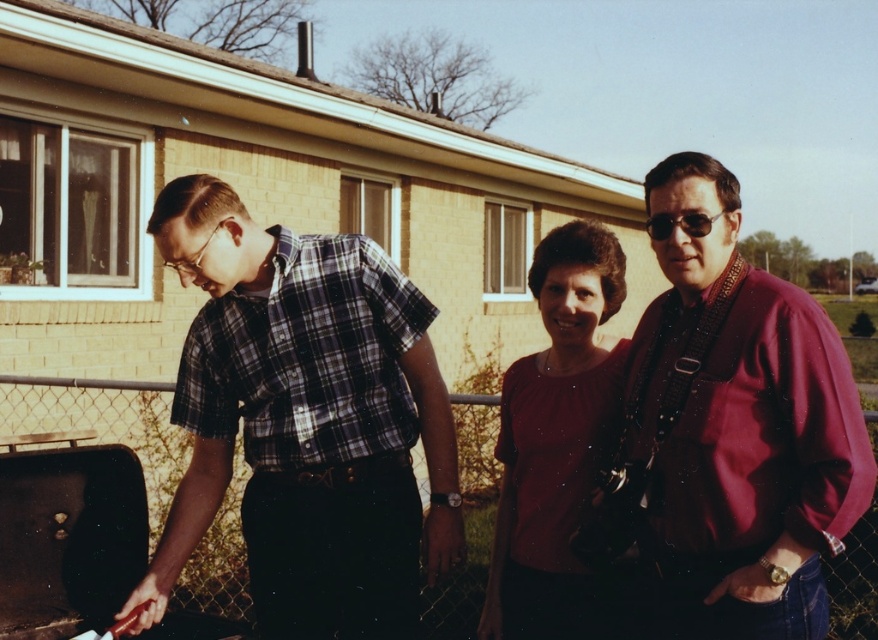
Question: Is plaid shirt at center thinner than metal chain-link fence at center?

Choices:
 (A) yes
 (B) no

Answer: (B)

Question: Estimate the real-world distances between objects in this image. Which object is closer to the plaid shirt at center?

Choices:
 (A) matte red blouse at center
 (B) metal chain-link fence at center
 (C) shiny black sunglasses at right
 (D) maroon fabric shirt at right

Answer: (A)

Question: Is maroon fabric shirt at right above shiny black sunglasses at right?

Choices:
 (A) yes
 (B) no

Answer: (B)

Question: Which of these objects is positioned closest to the shiny black sunglasses at right?

Choices:
 (A) metal chain-link fence at center
 (B) maroon fabric shirt at right
 (C) plaid shirt at center
 (D) matte red blouse at center

Answer: (B)

Question: Which point is closer to the camera taking this photo?

Choices:
 (A) (255, 586)
 (B) (624, 346)
 (C) (466, 406)

Answer: (B)

Question: Can you confirm if maroon fabric shirt at right is positioned above matte red blouse at center?

Choices:
 (A) yes
 (B) no

Answer: (A)